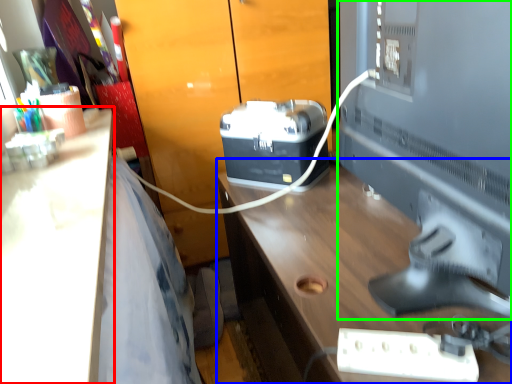
Question: Based on their relative distances, which object is farther from desk (highlighted by a red box)? Choose from desk (highlighted by a blue box) and desktop computer (highlighted by a green box).

Choices:
 (A) desk
 (B) desktop computer

Answer: (B)